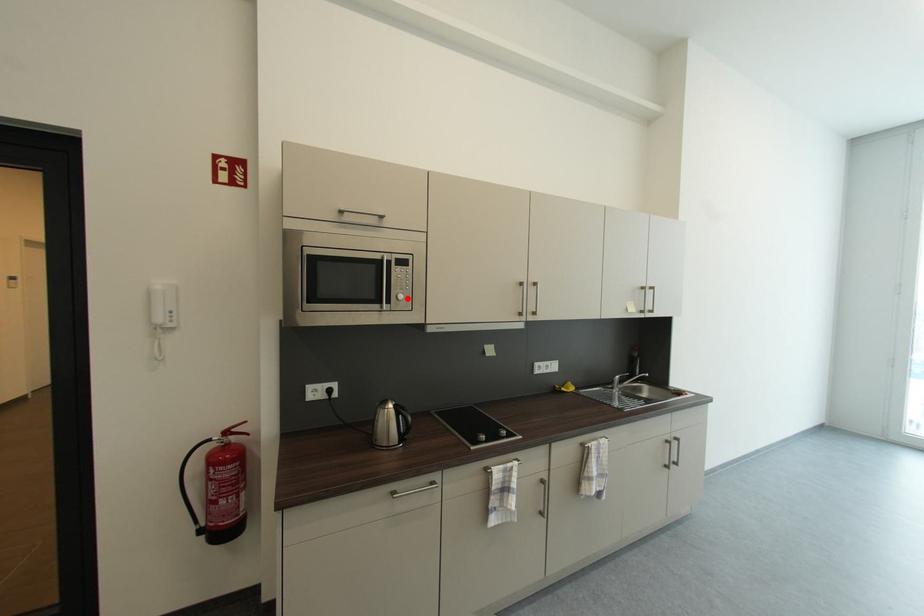
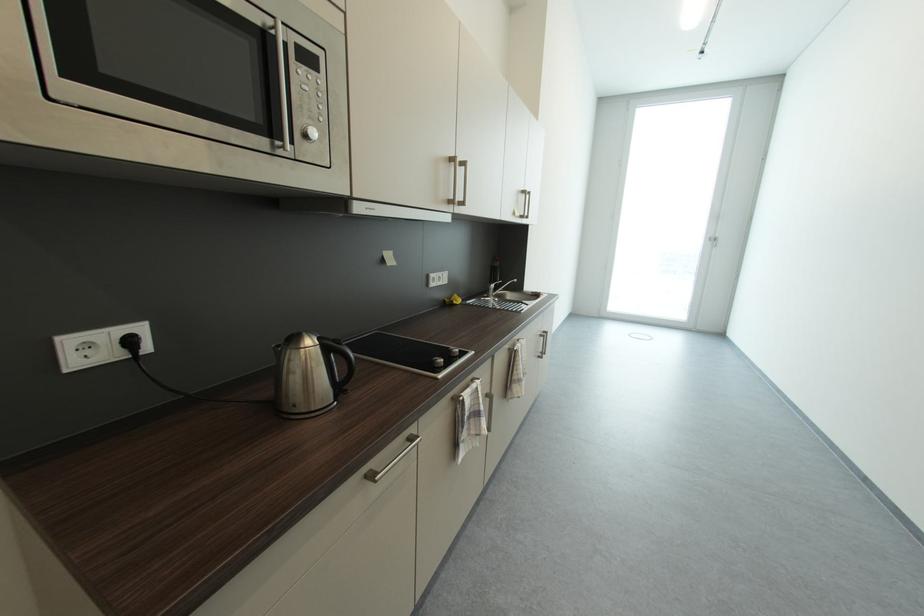
Locate, in the second image, the point that corresponds to the highlighted location in the first image.

(321, 134)